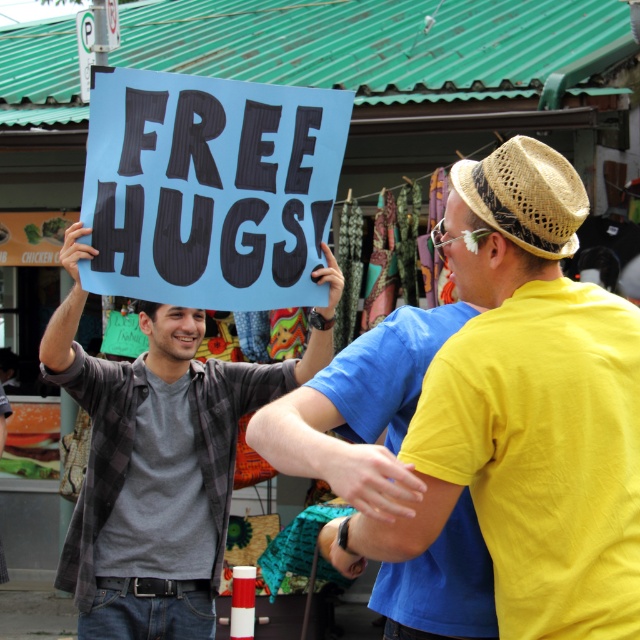
You are a photographer trying to capture the person holding the FREE HUGS! sign. Based on the scene, where should you focus your camera to ensure the matte gray shirt at center is in the frame?

The matte gray shirt at center is located at point (157,460), so you should focus your camera on that coordinate to include the matte gray shirt at center in the frame.

You are a photographer trying to capture the person in the bright yellow tshirt in this scene. The camera you are using has a limited field of view and can only focus on objects within a 0.5 unit radius around a specific point. If you center your camera at point (x=536, y=410), will the bright yellow tshirt be in focus?

The yellow matte shirt at right is located exactly at point (x=536, y=410). Since the camera focuses on objects within a 0.5 unit radius, the bright yellow tshirt will definitely be in focus as it is centered at the specified point.

You are a fashion designer analyzing this street scene. You notice the matte gray shirt at center and the straw woven hat at upper right. Which item is positioned higher in the image?

The matte gray shirt at center is much taller as straw woven hat at upper right, so the matte gray shirt at center is positioned higher in the image.